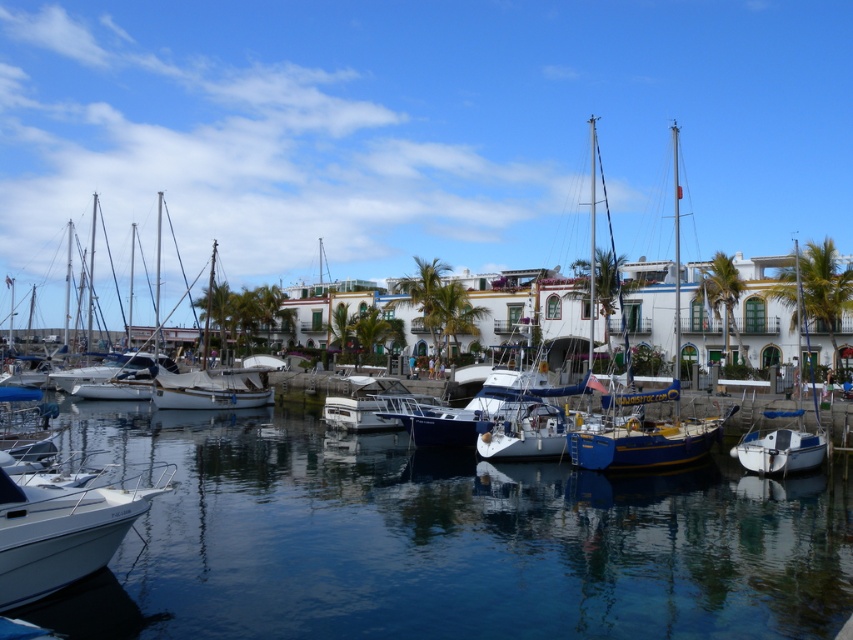
Question: Does blue glossy sailboat at center have a greater width compared to white matte boat at right?

Choices:
 (A) yes
 (B) no

Answer: (B)

Question: Which point is closer to the camera?

Choices:
 (A) (845, 292)
 (B) (567, 433)

Answer: (B)

Question: Which point is closer to the camera taking this photo?

Choices:
 (A) [227, 372]
 (B) [677, 428]
 (C) [567, 490]

Answer: (C)

Question: Which point is closer to the camera taking this photo?

Choices:
 (A) (476, 536)
 (B) (235, 397)

Answer: (A)

Question: Does white glossy sailboat at center have a lesser width compared to white matte sailboat at center?

Choices:
 (A) yes
 (B) no

Answer: (A)

Question: Is blue glossy sailboat at center positioned behind white matte boat at right?

Choices:
 (A) yes
 (B) no

Answer: (A)